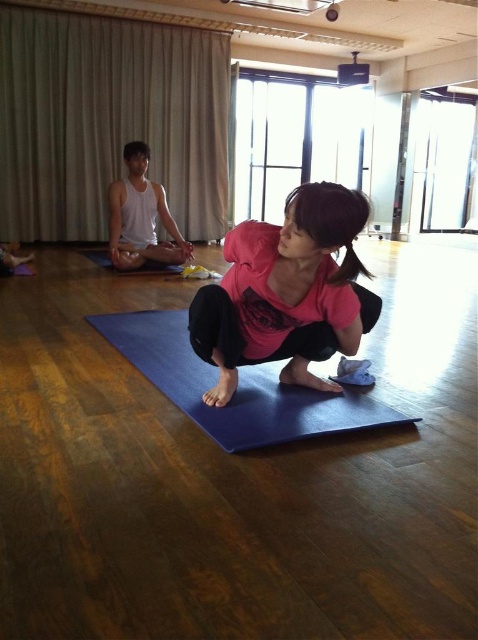
You are a photographer standing in front of the yoga class scene. You want to take a photo that includes both the blue rubber yoga mat at center and the white tank top at center. Which object will appear larger in the photo?

The blue rubber yoga mat at center will appear larger in the photo because it is closer to the viewer than the white tank top at center.

You are a photographer in the yoga studio and want to capture both the pink matte shirt at center and the white tank top at center in the same frame. Which one should you position your camera to the left of to ensure both are visible?

To capture both the pink matte shirt at center and the white tank top at center in the same frame, position your camera to the left of the pink matte shirt at center. Since the pink matte shirt at center is to the right of the white tank top at center, this positioning will ensure both are visible in the frame.